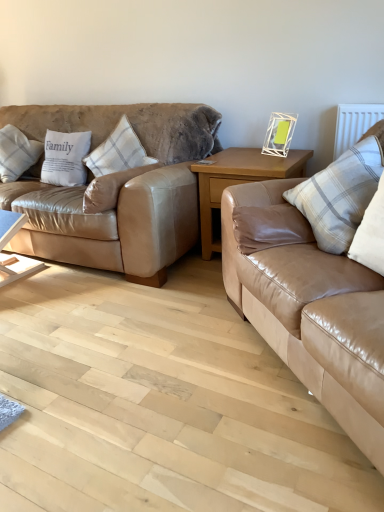
You are a GUI agent. You are given a task and a screenshot of the screen. Output one action in this format:
    pyautogui.click(x=<x>, y=<y>)
    Task: Click on the blank space above white textured radiator at upper right (from a real-world perspective)
    This screenshot has width=384, height=512.
    Given the screenshot: What is the action you would take?
    pyautogui.click(x=365, y=96)